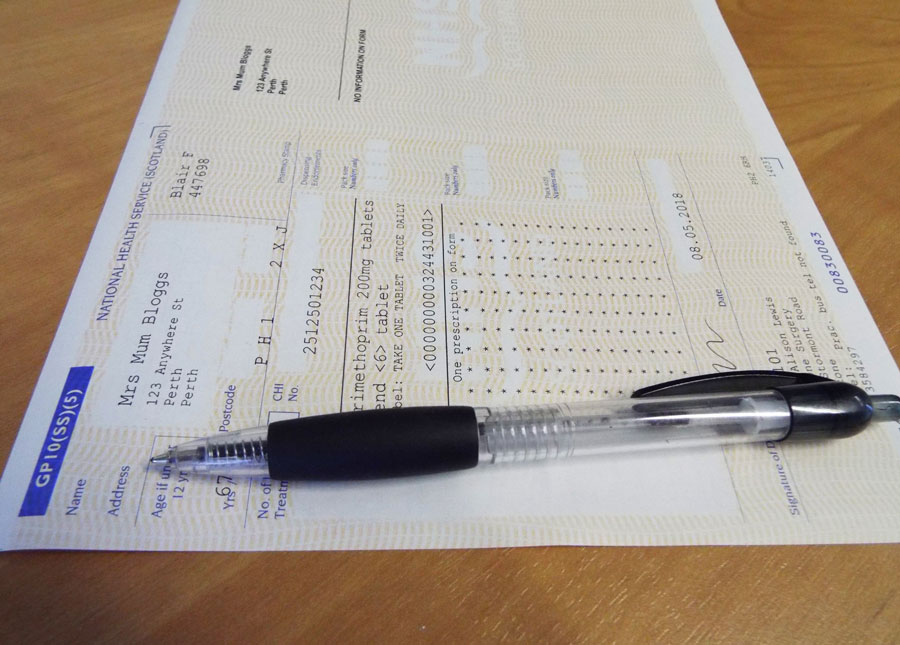
Find the location of a particular element. pen is located at coordinates (387, 433).